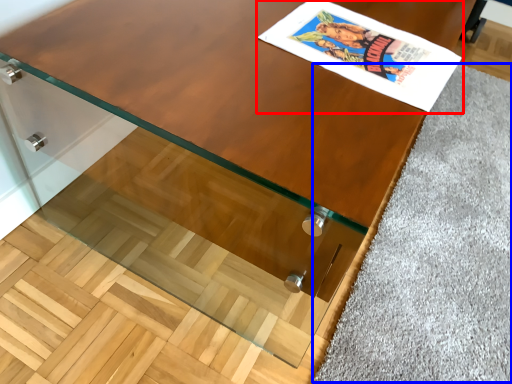
Question: Which point is closer to the camera, comic book (highlighted by a red box) or gray (highlighted by a blue box)?

Choices:
 (A) comic book
 (B) gray

Answer: (A)